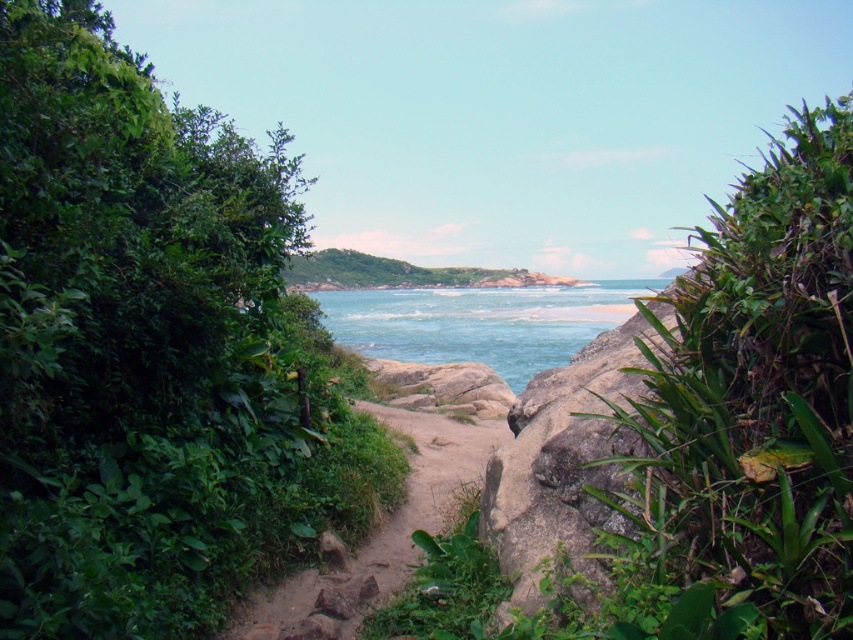
Question: Which point is closer to the camera?

Choices:
 (A) green leafy bush at left
 (B) green leafy plant at right
 (C) dirt path at center
 (D) blue clear water at center

Answer: (B)

Question: Where is green leafy bush at left located in relation to green leafy plant at right in the image?

Choices:
 (A) above
 (B) below

Answer: (A)

Question: Which of the following is the closest to the observer?

Choices:
 (A) green leafy plant at right
 (B) green leafy bush at left
 (C) dirt path at center
 (D) blue clear water at center

Answer: (A)

Question: Which point is closer to the camera taking this photo?

Choices:
 (A) (381, 346)
 (B) (91, 412)

Answer: (B)

Question: Is green leafy plant at right below dirt path at center?

Choices:
 (A) no
 (B) yes

Answer: (A)

Question: Is the position of green leafy bush at left less distant than that of dirt path at center?

Choices:
 (A) yes
 (B) no

Answer: (A)